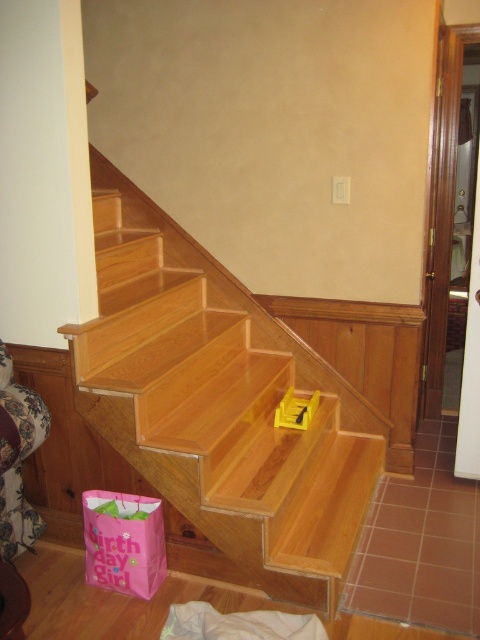
Does point (331, 589) come in front of point (288, 404)?

Yes, it is in front of point (288, 404).

Is natural wood stairs at center smaller than yellow plastic toy at center?

Incorrect, natural wood stairs at center is not smaller in size than yellow plastic toy at center.

Which is in front, point (315, 538) or point (291, 413)?

Point (315, 538) is in front.

This screenshot has height=640, width=480. I want to click on natural wood stairs at center, so click(x=219, y=403).